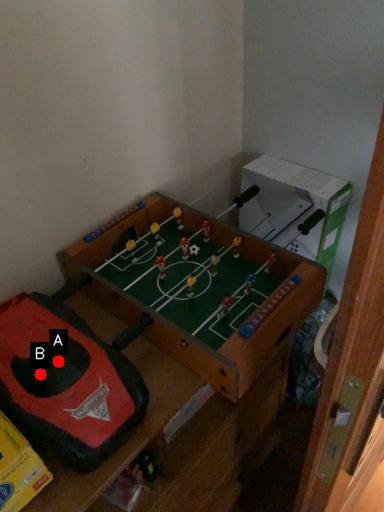
Question: Two points are circled on the image, labeled by A and B beside each circle. Which point is further to the camera?

Choices:
 (A) A is further
 (B) B is further

Answer: (A)